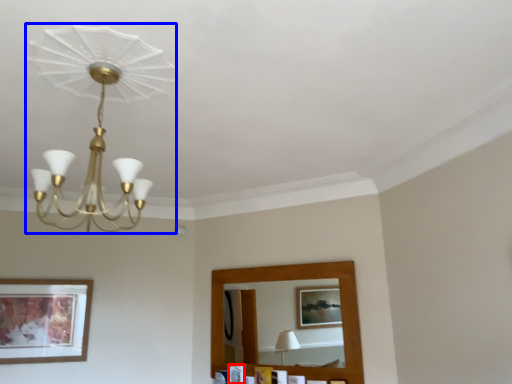
Question: Among these objects, which one is nearest to the camera, picture frame (highlighted by a red box) or lamp (highlighted by a blue box)?

Choices:
 (A) picture frame
 (B) lamp

Answer: (B)